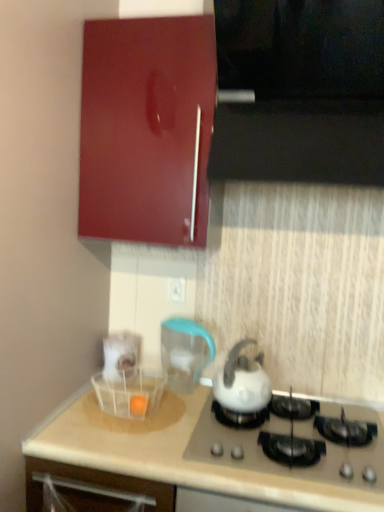
Image resolution: width=384 pixels, height=512 pixels. Find the location of `free space in front of transparent plastic basket at lower center`. free space in front of transparent plastic basket at lower center is located at coordinates (115, 450).